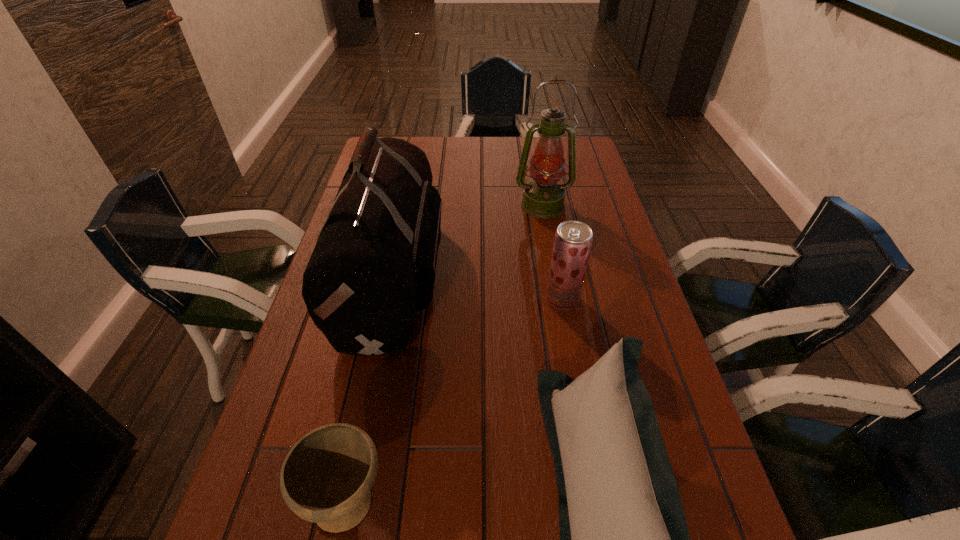
This screenshot has height=540, width=960. I want to click on oil lamp, so click(543, 197).

The height and width of the screenshot is (540, 960). I want to click on duffel bag, so click(x=374, y=264).

You are a GUI agent. You are given a task and a screenshot of the screen. Output one action in this format:
    pyautogui.click(x=<x>, y=<y>)
    Task: Click on the third shortest object
    
    Given the screenshot: What is the action you would take?
    pyautogui.click(x=573, y=239)

Identify the location of vacant space located 0.400m on the left of the oil lamp. (393, 205).

In order to click on vacant space located 0.160m on the front pocket of the duffel bag in this screenshot , I will do `click(501, 275)`.

Identify the location of vacant area situated on the left of the fruit juice. This screenshot has height=540, width=960. (419, 300).

In order to click on object present at the left edge in this screenshot , I will do [374, 264].

Where is `object that is at the right edge`? object that is at the right edge is located at coordinates (543, 197).

Image resolution: width=960 pixels, height=540 pixels. What are the coordinates of `blank area at the far edge` in the screenshot? It's located at (x=444, y=145).

Image resolution: width=960 pixels, height=540 pixels. I want to click on free region at the right edge of the desktop, so click(x=637, y=330).